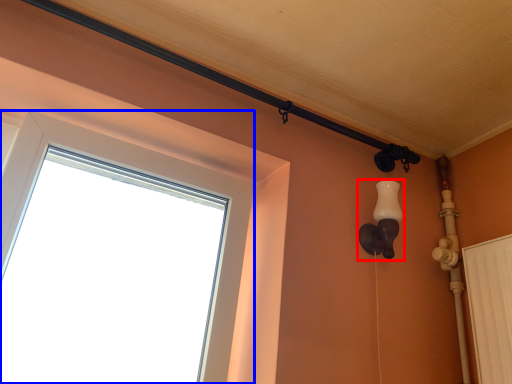
Question: Which of the following is the farthest to the observer, light fixture (highlighted by a red box) or window (highlighted by a blue box)?

Choices:
 (A) light fixture
 (B) window

Answer: (A)